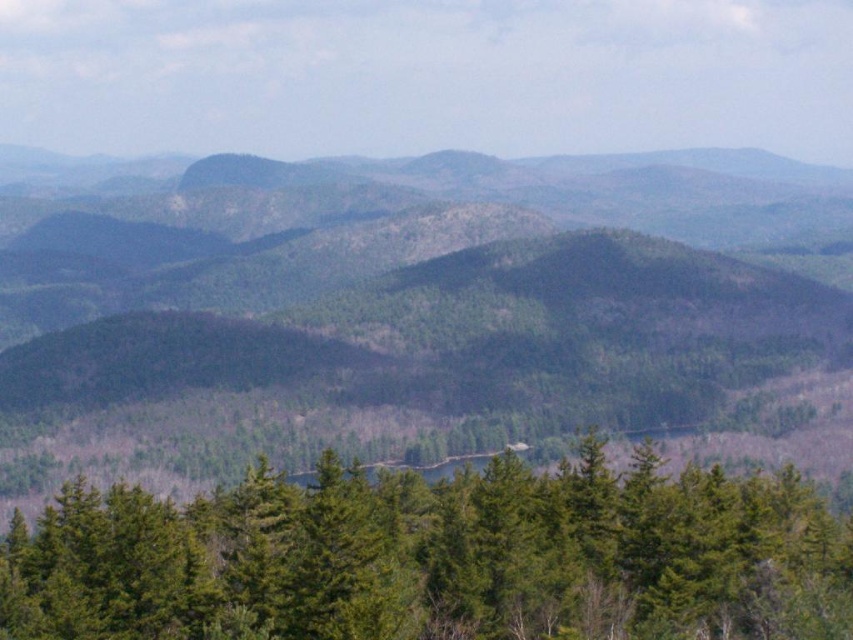
Can you confirm if green forested mountain at center is positioned above green matte trees at center?

Yes.

Does point (695, 276) come farther from viewer compared to point (811, 621)?

Yes.

I want to click on green forested mountain at center, so click(x=422, y=312).